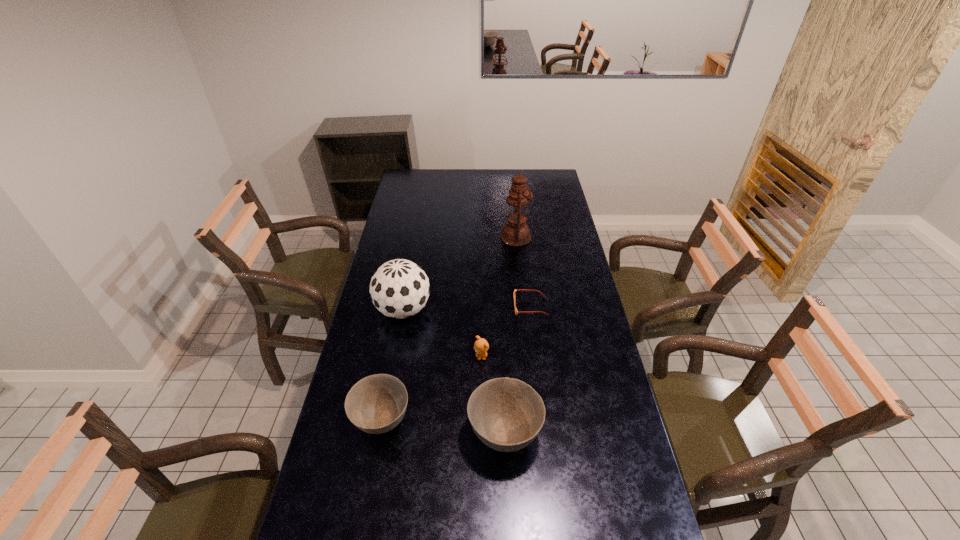
The height and width of the screenshot is (540, 960). I want to click on the left bowl, so click(376, 404).

You are a GUI agent. You are given a task and a screenshot of the screen. Output one action in this format:
    pyautogui.click(x=<x>, y=<y>)
    Task: Click on the shorter bowl
    Image resolution: width=960 pixels, height=540 pixels.
    Given the screenshot: What is the action you would take?
    pyautogui.click(x=376, y=404)

Find the location of a particular element. the taller bowl is located at coordinates (506, 414).

Where is `the third tallest object`? The image size is (960, 540). the third tallest object is located at coordinates (506, 414).

The width and height of the screenshot is (960, 540). I want to click on the tallest object, so click(516, 233).

Where is `oil lamp`? oil lamp is located at coordinates click(516, 233).

What are the coordinates of `spectacles` in the screenshot? It's located at (527, 290).

This screenshot has height=540, width=960. Find the location of `the fifth shortest object`. the fifth shortest object is located at coordinates (399, 288).

Locate an element on the screen. Image resolution: width=960 pixels, height=540 pixels. the third nearest object is located at coordinates (481, 346).

Where is `teddy bear`? teddy bear is located at coordinates (481, 346).